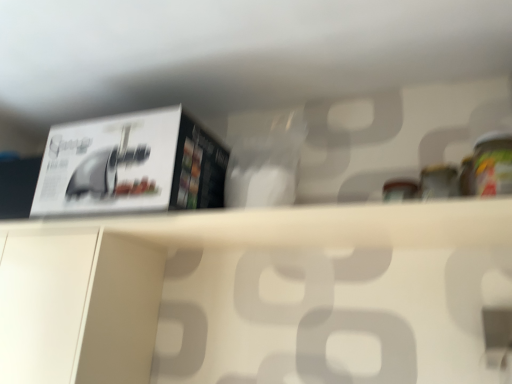
Question: Can you confirm if white matte paper at upper left is bigger than white matte shelf at center?

Choices:
 (A) no
 (B) yes

Answer: (B)

Question: Can you confirm if white matte paper at upper left is thinner than white matte shelf at center?

Choices:
 (A) no
 (B) yes

Answer: (A)

Question: Is white matte paper at upper left aimed at white matte shelf at center?

Choices:
 (A) no
 (B) yes

Answer: (A)

Question: Are white matte paper at upper left and white matte shelf at center located far from each other?

Choices:
 (A) no
 (B) yes

Answer: (A)

Question: From the image's perspective, would you say white matte paper at upper left is positioned over white matte shelf at center?

Choices:
 (A) no
 (B) yes

Answer: (B)

Question: Is white matte paper at upper left taller than white matte shelf at center?

Choices:
 (A) yes
 (B) no

Answer: (A)

Question: Is white matte shelf at center looking in the opposite direction of white matte paper at upper left?

Choices:
 (A) yes
 (B) no

Answer: (B)

Question: From a real-world perspective, does white matte shelf at center sit lower than white matte paper at upper left?

Choices:
 (A) no
 (B) yes

Answer: (B)

Question: Is white matte shelf at center behind white matte paper at upper left?

Choices:
 (A) yes
 (B) no

Answer: (B)

Question: Does white matte shelf at center have a larger size compared to white matte paper at upper left?

Choices:
 (A) yes
 (B) no

Answer: (B)

Question: Is white matte shelf at center positioned far away from white matte paper at upper left?

Choices:
 (A) no
 (B) yes

Answer: (A)

Question: Can you confirm if white matte shelf at center is thinner than white matte paper at upper left?

Choices:
 (A) no
 (B) yes

Answer: (B)

Question: From the image's perspective, is white matte paper at upper left positioned above or below white matte shelf at center?

Choices:
 (A) below
 (B) above

Answer: (B)